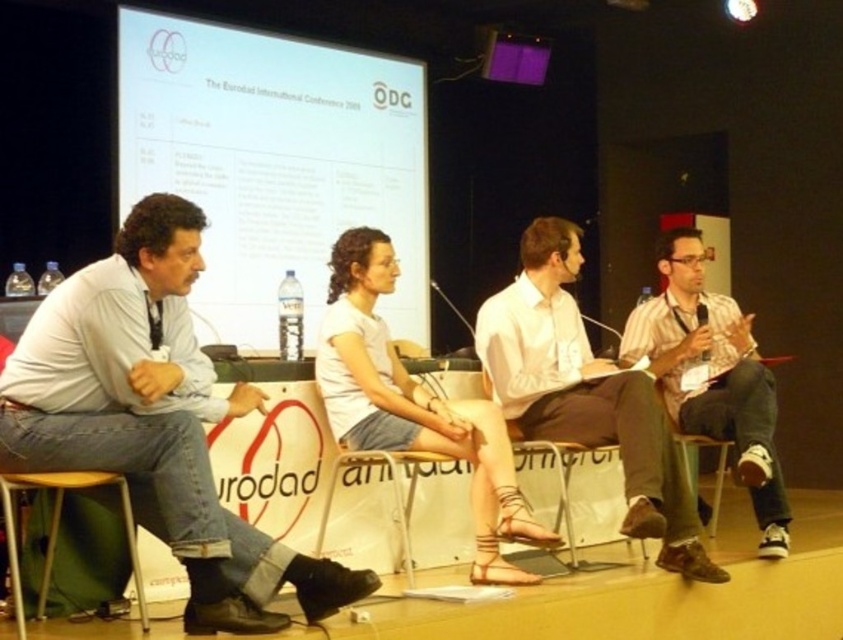
Question: Which point is farther from the camera taking this photo?

Choices:
 (A) (400, 536)
 (B) (722, 406)

Answer: (B)

Question: Is white fabric skirt at center above wooden at right?

Choices:
 (A) yes
 (B) no

Answer: (A)

Question: Is white shirt at center smaller than wooden at left?

Choices:
 (A) no
 (B) yes

Answer: (A)

Question: Is white fabric skirt at center closer to camera compared to striped cotton shirt at center?

Choices:
 (A) yes
 (B) no

Answer: (A)

Question: Among these objects, which one is farthest from the camera?

Choices:
 (A) striped cotton shirt at center
 (B) white plastic chair at center

Answer: (A)

Question: Which object is closer to the camera taking this photo?

Choices:
 (A) white glossy projection screen at upper center
 (B) light blue shirt at left
 (C) white plastic chair at center

Answer: (B)